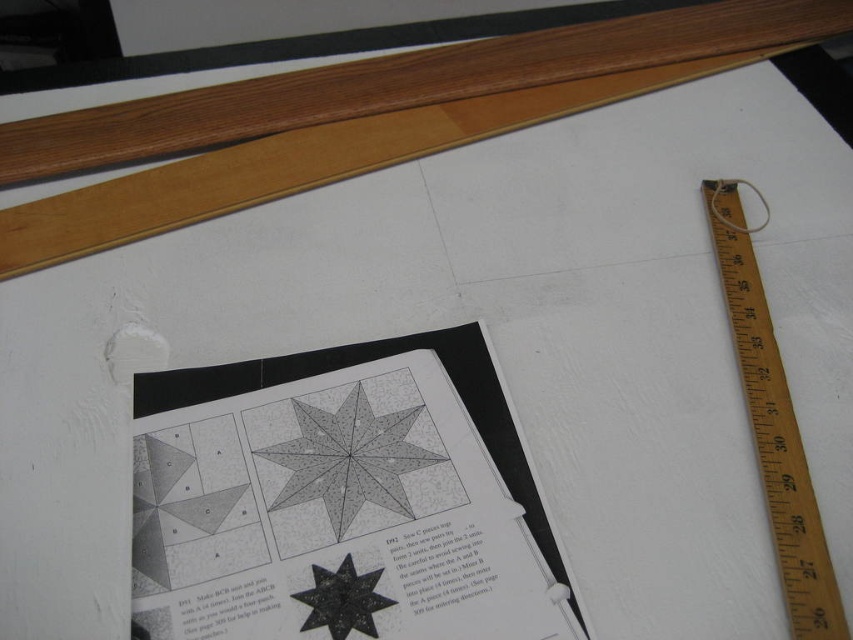
Question: Is gray paper at center to the right of gray dotted star at center from the viewer's perspective?

Choices:
 (A) yes
 (B) no

Answer: (B)

Question: Which point is closer to the camera?

Choices:
 (A) (247, 531)
 (B) (318, 582)
 (C) (334, 432)
 (D) (728, 308)

Answer: (B)

Question: Estimate the real-world distances between objects in this image. Which object is farther from the wooden ruler at right?

Choices:
 (A) black matte star at center
 (B) gray paper at center

Answer: (A)

Question: Which point is farther to the camera?

Choices:
 (A) (378, 490)
 (B) (381, 595)
 (C) (296, 596)

Answer: (A)

Question: Is gray paper at center bigger than black matte star at center?

Choices:
 (A) no
 (B) yes

Answer: (B)

Question: Is wooden ruler at right further to the viewer compared to black matte star at center?

Choices:
 (A) no
 (B) yes

Answer: (A)